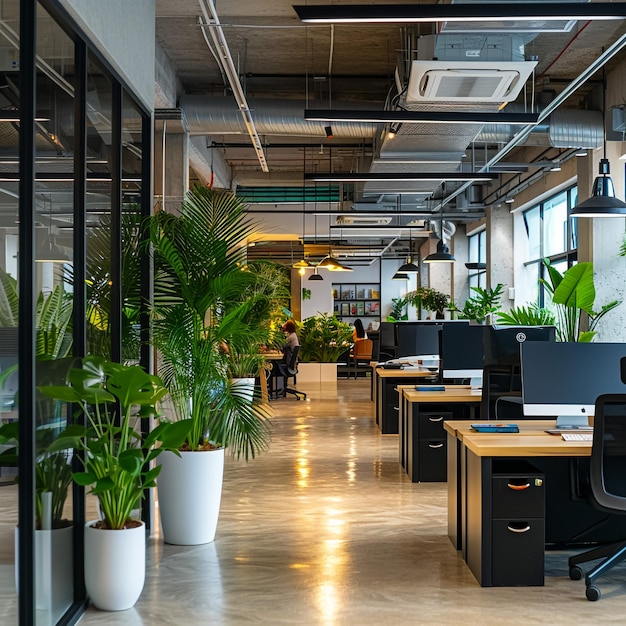
You are a GUI agent. You are given a task and a screenshot of the screen. Output one action in this format:
    pyautogui.click(x=<x>, y=<y>)
    Task: Click on the ceiling of the office
    Image resolution: width=626 pixels, height=626 pixels.
    Given the screenshot: What is the action you would take?
    (x=307, y=59)